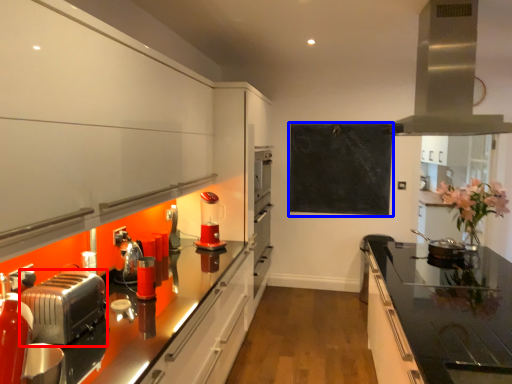
Question: Which object appears closest to the camera in this image, toaster (highlighted by a red box) or bulletin board (highlighted by a blue box)?

Choices:
 (A) toaster
 (B) bulletin board

Answer: (A)